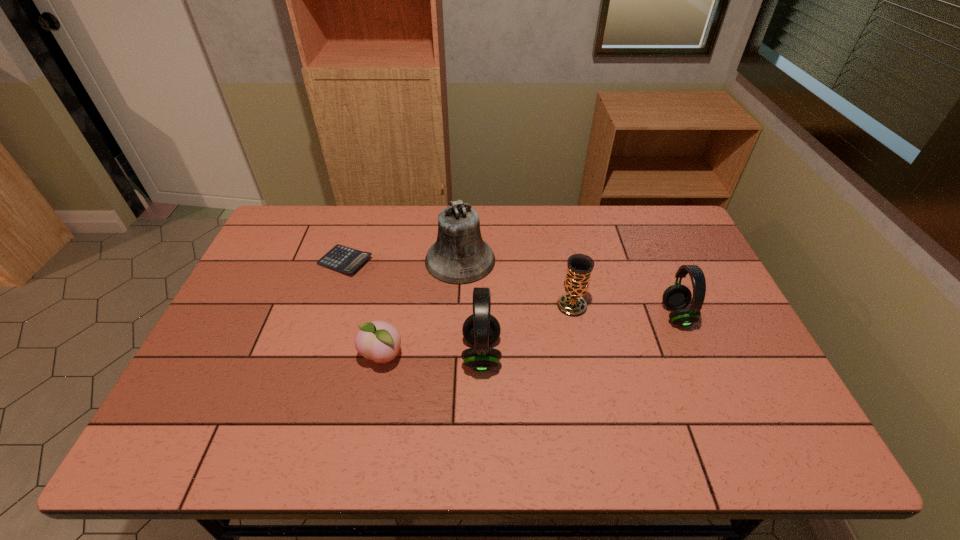
Locate an element on the screen. unoccupied position between the taller headset and the second object from right to left is located at coordinates (527, 330).

Locate an element on the screen. free space between the shorter headset and the left headset is located at coordinates (579, 335).

I want to click on object that stands as the fourth closest to the peach, so tap(579, 266).

Locate an element on the screen. The image size is (960, 540). object that stands as the third closest to the taller headset is located at coordinates (579, 266).

Identify the location of free spot that satisfies the following two spatial constraints: 1. on the ear cups of the taller headset; 2. on the front side of the fifth object from right to left. (482, 357).